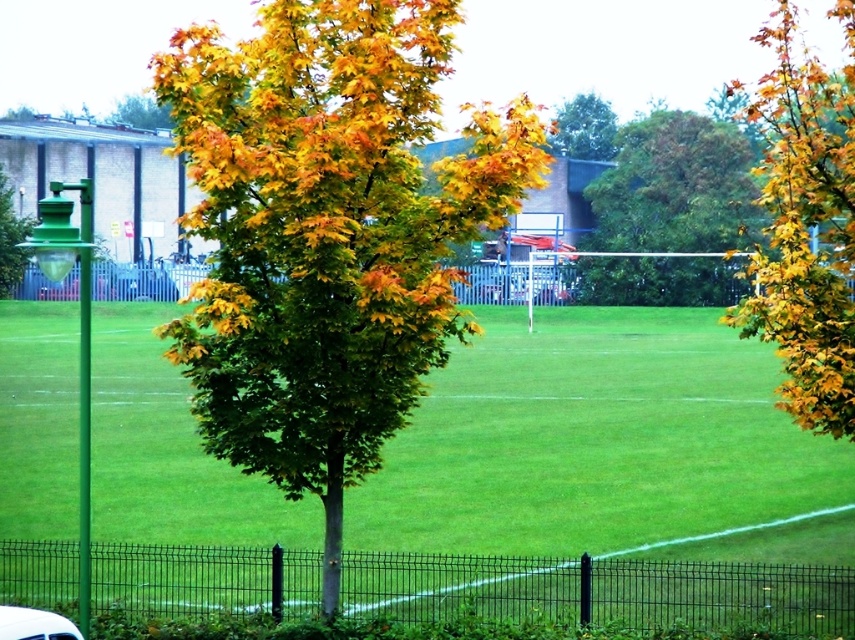
Looking at this image, you are standing on the volleyball court and notice the green grass at center and the green leafy tree at upper center. Which object is positioned to the left of the other?

The green grass at center is to the left of green leafy tree at upper center.

You are planning to set up a picnic blanket in the green grass at center. Considering the size of the green leafy tree at upper center, will the tree provide sufficient shade for your picnic blanket? Please explain your reasoning based on the scene description.

The green grass at center is larger in size than the green leafy tree at upper center. Since the grass area is bigger, the tree might not cast enough shade to fully cover the picnic blanket. Therefore, the shade provided by the tree may be insufficient for the entire picnic area.